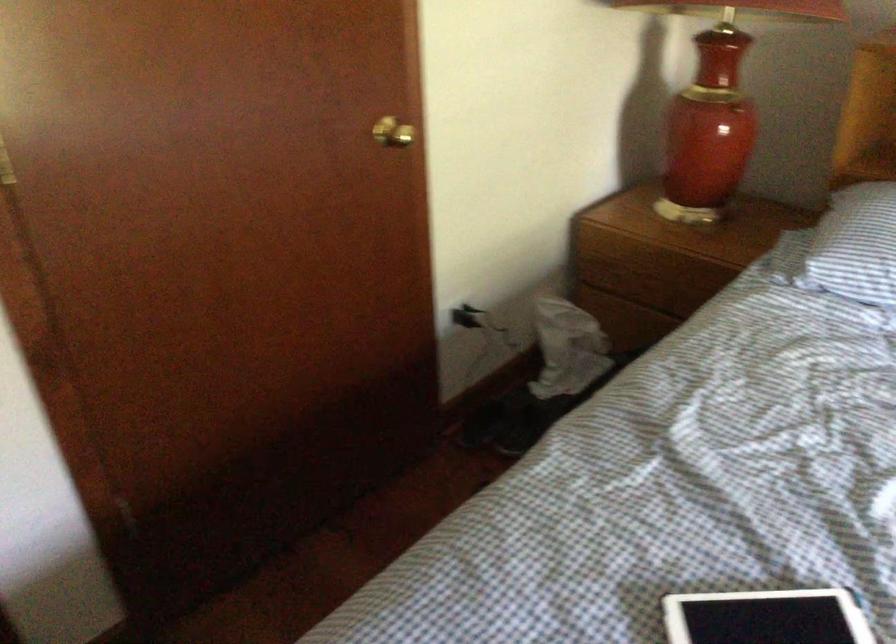
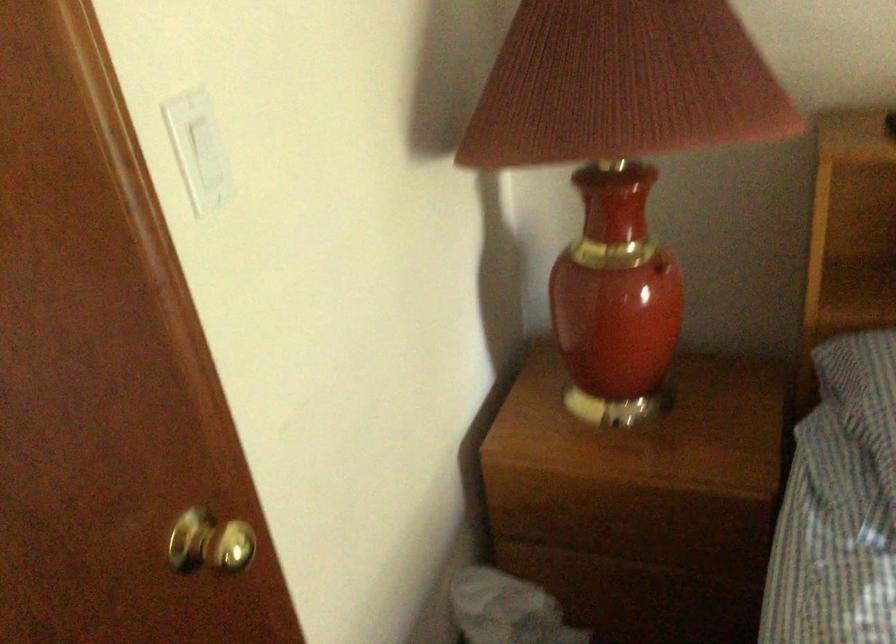
Question: The camera is either moving clockwise (left) or counter-clockwise (right) around the object. The first image is from the beginning of the video and the second image is from the end. Is the camera moving left or right when shooting the video?

Choices:
 (A) Left
 (B) Right

Answer: (A)